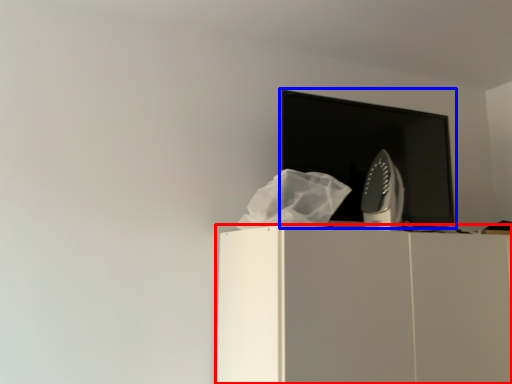
Question: Which of the following is the farthest to the observer, furniture (highlighted by a red box) or computer monitor (highlighted by a blue box)?

Choices:
 (A) furniture
 (B) computer monitor

Answer: (B)